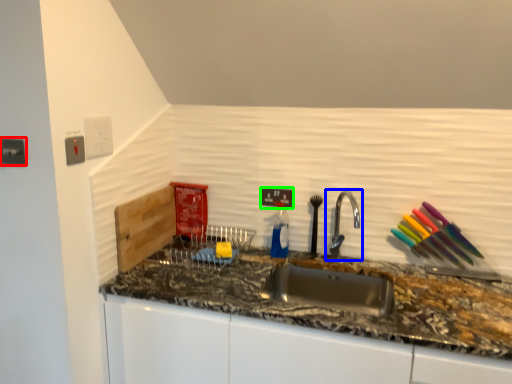
Question: Considering the real-world distances, which object is closest to electric outlet (highlighted by a red box)? tap (highlighted by a blue box) or electric outlet (highlighted by a green box).

Choices:
 (A) tap
 (B) electric outlet

Answer: (B)